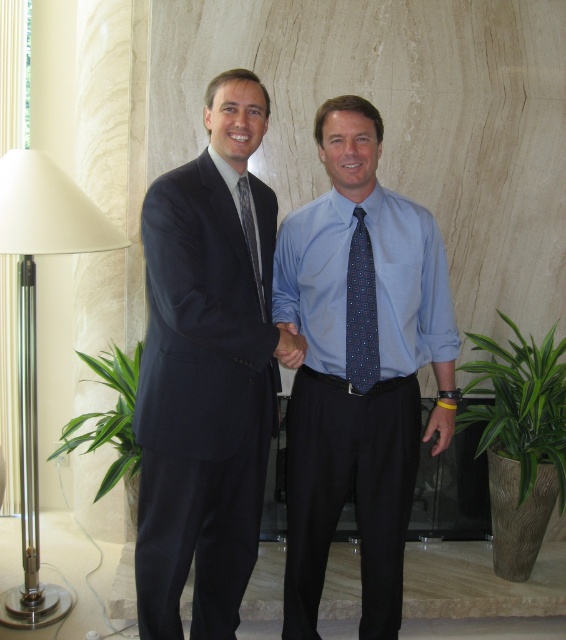
Question: Which of the following is the closest to the observer?

Choices:
 (A) blue dotted tie at center
 (B) white glossy floor lamp at left

Answer: (A)

Question: Is white glossy floor lamp at left to the right of blue dotted tie at center from the viewer's perspective?

Choices:
 (A) no
 (B) yes

Answer: (A)

Question: From the image, what is the correct spatial relationship of matte black suit at center in relation to blue silk shirt at center?

Choices:
 (A) above
 (B) below

Answer: (A)

Question: Which object is closer to the camera taking this photo?

Choices:
 (A) patterned silk tie at center
 (B) blue silk shirt at center

Answer: (B)

Question: From the image, what is the correct spatial relationship of white glossy floor lamp at left in relation to blue dotted tie at center?

Choices:
 (A) above
 (B) below

Answer: (B)

Question: Which of the following is the farthest from the observer?

Choices:
 (A) patterned silk tie at center
 (B) blue silk shirt at center

Answer: (A)